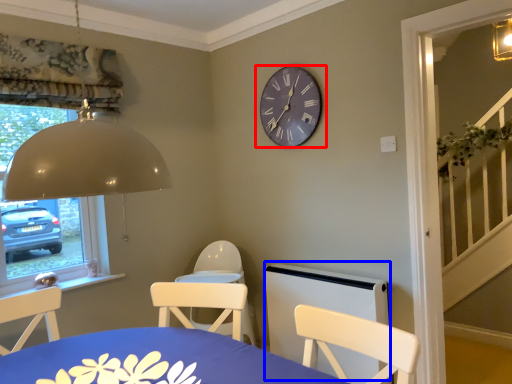
Question: Which point is closer to the camera, wall clock (highlighted by a red box) or bed frame (highlighted by a blue box)?

Choices:
 (A) wall clock
 (B) bed frame

Answer: (B)